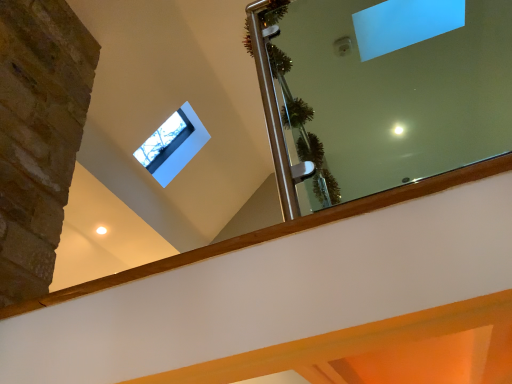
What do you see at coordinates (173, 145) in the screenshot?
I see `transparent glass window at upper center` at bounding box center [173, 145].

The height and width of the screenshot is (384, 512). I want to click on transparent glass window at upper center, so click(x=173, y=145).

The height and width of the screenshot is (384, 512). I want to click on clear glass mirror at upper center, so click(x=380, y=91).

What do you see at coordinates (380, 91) in the screenshot?
I see `clear glass mirror at upper center` at bounding box center [380, 91].

Where is `transparent glass window at upper center`? This screenshot has width=512, height=384. transparent glass window at upper center is located at coordinates (173, 145).

Which object is positioned more to the left, clear glass mirror at upper center or transparent glass window at upper center?

transparent glass window at upper center.

Considering the relative positions of clear glass mirror at upper center and transparent glass window at upper center in the image provided, is clear glass mirror at upper center behind transparent glass window at upper center?

No, it is not.

Considering the positions of points (276, 138) and (160, 168), is point (276, 138) farther from camera compared to point (160, 168)?

No, it is in front of (160, 168).

From the image's perspective, is clear glass mirror at upper center under transparent glass window at upper center?

No, from the image's perspective, clear glass mirror at upper center is not below transparent glass window at upper center.

From a real-world perspective, is clear glass mirror at upper center physically located above or below transparent glass window at upper center?

In terms of real-world spatial position, clear glass mirror at upper center is below transparent glass window at upper center.

Between clear glass mirror at upper center and transparent glass window at upper center, which one has smaller width?

With smaller width is transparent glass window at upper center.

Does clear glass mirror at upper center have a lesser height compared to transparent glass window at upper center?

Incorrect, the height of clear glass mirror at upper center does not fall short of that of transparent glass window at upper center.

Considering the sizes of objects clear glass mirror at upper center and transparent glass window at upper center in the image provided, who is bigger, clear glass mirror at upper center or transparent glass window at upper center?

clear glass mirror at upper center is bigger.

Looking at this image, could transparent glass window at upper center be considered to be inside clear glass mirror at upper center?

No, transparent glass window at upper center is not surrounded by clear glass mirror at upper center.

Would you consider clear glass mirror at upper center to be distant from transparent glass window at upper center?

Indeed, clear glass mirror at upper center is not near transparent glass window at upper center.

Is clear glass mirror at upper center aimed at transparent glass window at upper center?

No, clear glass mirror at upper center is not facing towards transparent glass window at upper center.

What's the angular difference between clear glass mirror at upper center and transparent glass window at upper center's facing directions?

The angular difference between clear glass mirror at upper center and transparent glass window at upper center is 87.7 degrees.

How far apart are clear glass mirror at upper center and transparent glass window at upper center?

clear glass mirror at upper center and transparent glass window at upper center are 4.37 feet apart from each other.

At what (x,y) coordinates should I click in order to perform the action: click on window on the left of clear glass mirror at upper center. Please return your answer as a coordinate pair (x, y). This screenshot has width=512, height=384. Looking at the image, I should click on (173, 145).

Looking at this image, does transparent glass window at upper center appear on the right side of clear glass mirror at upper center?

In fact, transparent glass window at upper center is to the left of clear glass mirror at upper center.

Is transparent glass window at upper center positioned behind clear glass mirror at upper center?

Yes, the depth of transparent glass window at upper center is greater than that of clear glass mirror at upper center.

Does point (160, 177) come behind point (401, 108)?

No, it is not.

From the image's perspective, is transparent glass window at upper center over clear glass mirror at upper center?

No, from the image's perspective, transparent glass window at upper center is not over clear glass mirror at upper center.

From a real-world perspective, is transparent glass window at upper center positioned above or below clear glass mirror at upper center?

Clearly, from a real-world perspective, transparent glass window at upper center is above clear glass mirror at upper center.

Based on the photo, can you confirm if transparent glass window at upper center is wider than clear glass mirror at upper center?

No.

From their relative heights in the image, would you say transparent glass window at upper center is taller or shorter than clear glass mirror at upper center?

In the image, transparent glass window at upper center appears to be shorter than clear glass mirror at upper center.

Considering the relative sizes of transparent glass window at upper center and clear glass mirror at upper center in the image provided, is transparent glass window at upper center smaller than clear glass mirror at upper center?

Yes.

Can we say transparent glass window at upper center lies outside clear glass mirror at upper center?

transparent glass window at upper center lies outside clear glass mirror at upper center's area.

Is transparent glass window at upper center far from clear glass mirror at upper center?

Yes, transparent glass window at upper center is far from clear glass mirror at upper center.

In the scene shown: Could you tell me if transparent glass window at upper center is turned towards clear glass mirror at upper center?

No, transparent glass window at upper center is not oriented towards clear glass mirror at upper center.

What's the angular difference between transparent glass window at upper center and clear glass mirror at upper center's facing directions?

87.7 degrees separate the facing orientations of transparent glass window at upper center and clear glass mirror at upper center.

This screenshot has width=512, height=384. Find the location of `mirror that is under the transparent glass window at upper center (from a real-world perspective)`. mirror that is under the transparent glass window at upper center (from a real-world perspective) is located at coordinates (380, 91).

The height and width of the screenshot is (384, 512). What are the coordinates of `mirror in front of the transparent glass window at upper center` in the screenshot? It's located at (380, 91).

Find the location of a particular element. mirror on the right of transparent glass window at upper center is located at coordinates (380, 91).